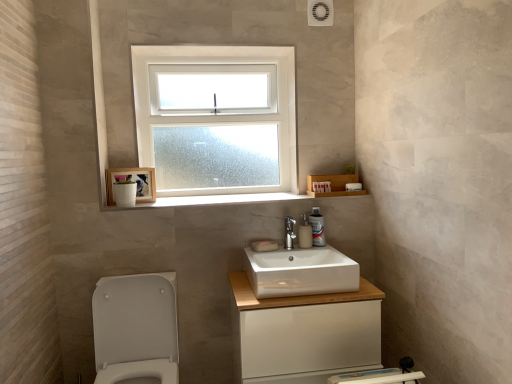
Question: Considering the positions of white matte soap at center, acting as the 2th soap starting from the back, and clear glass window at upper center in the image, is white matte soap at center, acting as the 2th soap starting from the back, taller or shorter than clear glass window at upper center?

Choices:
 (A) tall
 (B) short

Answer: (B)

Question: From the image's perspective, relative to clear glass window at upper center, is white matte soap at center, acting as the 2th soap starting from the back, above or below?

Choices:
 (A) above
 (B) below

Answer: (B)

Question: Which is farther from the satin nickel faucet at center?

Choices:
 (A) white glossy cabinet at center
 (B) white glossy toilet at lower left
 (C) translucent plastic soap dispenser at center, marked as the second soap dispenser in a right-to-left arrangement
 (D) white matte soap at center, acting as the 2th soap starting from the back
 (E) white matte soap at center, the first soap in the back-to-front sequence

Answer: (B)

Question: Which is nearer to the white matte soap at center, acting as the 2th soap starting from the back?

Choices:
 (A) white matte soap at center, the first soap in the back-to-front sequence
 (B) white glossy cabinet at center
 (C) white plastic soap dispenser at upper center, the 2th soap dispenser when ordered from left to right
 (D) white marble window sill at center
 (E) satin nickel faucet at center

Answer: (A)